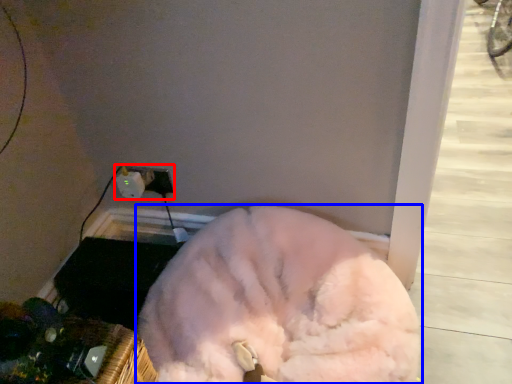
Question: Which of the following is the closest to the observer, electric outlet (highlighted by a red box) or dog (highlighted by a blue box)?

Choices:
 (A) electric outlet
 (B) dog

Answer: (B)